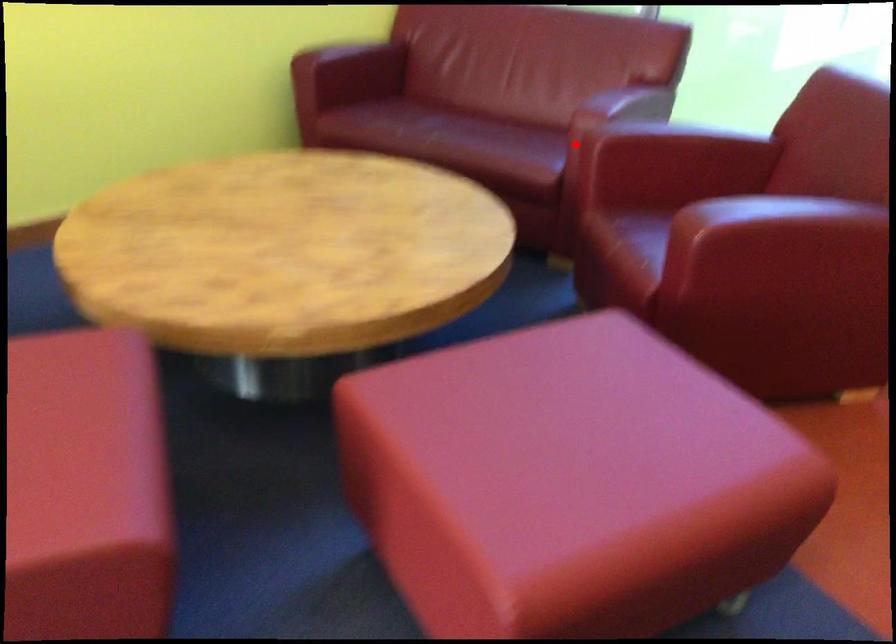
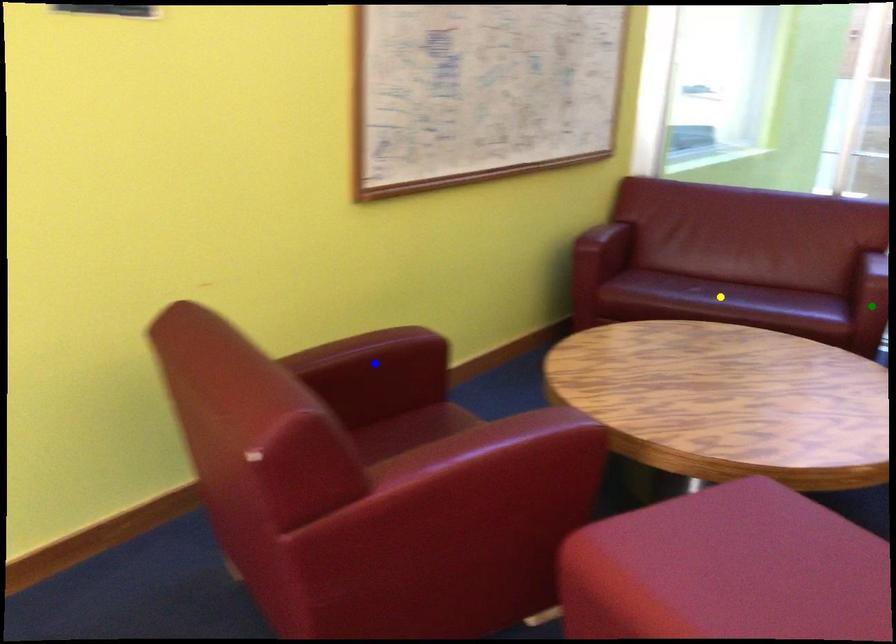
Question: I am providing you with two images of the same scene from different viewpoints. A red point is marked on the first image. You are given multiple points on the second image. In image 2, which mark is for the same physical point as the one in image 1?

Choices:
 (A) yellow point
 (B) blue point
 (C) green point

Answer: (C)